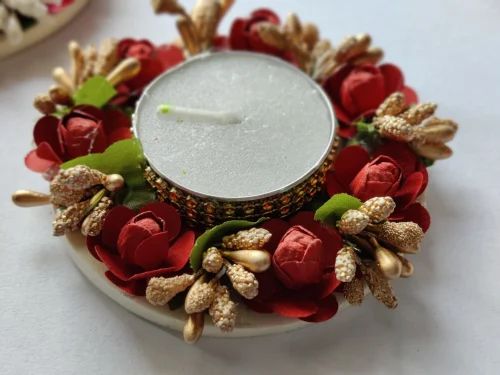
Identify the location of votive candle. (243, 135).